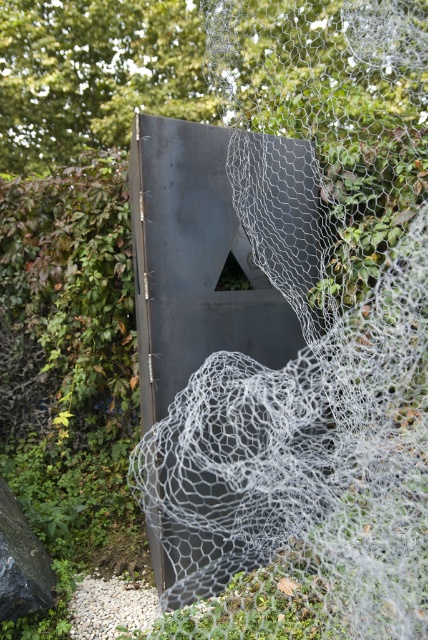
Question: Is white mesh netting at center below green leafy hedge at left?

Choices:
 (A) yes
 (B) no

Answer: (A)

Question: Can you confirm if white mesh netting at center is positioned above green leafy hedge at left?

Choices:
 (A) yes
 (B) no

Answer: (B)

Question: Which point is closer to the camera?

Choices:
 (A) (92, 276)
 (B) (321, 561)

Answer: (B)

Question: Is white mesh netting at center bigger than green leafy hedge at left?

Choices:
 (A) yes
 (B) no

Answer: (A)

Question: Which point appears closest to the camera in this image?

Choices:
 (A) (71, 339)
 (B) (241, 499)

Answer: (B)